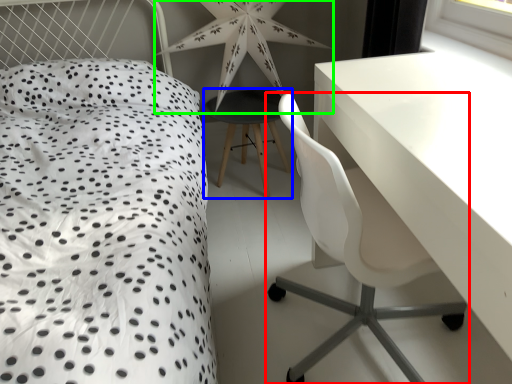
Question: Considering the real-world distances, which object is closest to chair (highlighted by a red box)? bar stool (highlighted by a blue box) or star (highlighted by a green box).

Choices:
 (A) bar stool
 (B) star

Answer: (A)